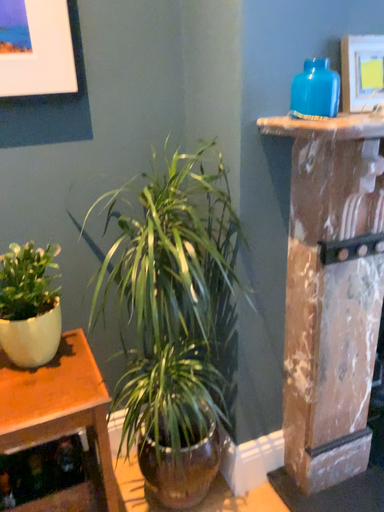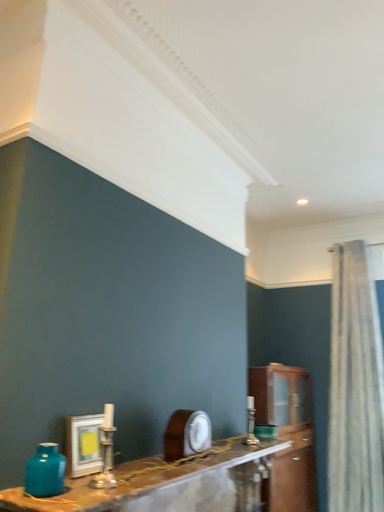
Question: How did the camera likely rotate when shooting the video?

Choices:
 (A) rotated left
 (B) rotated right

Answer: (B)